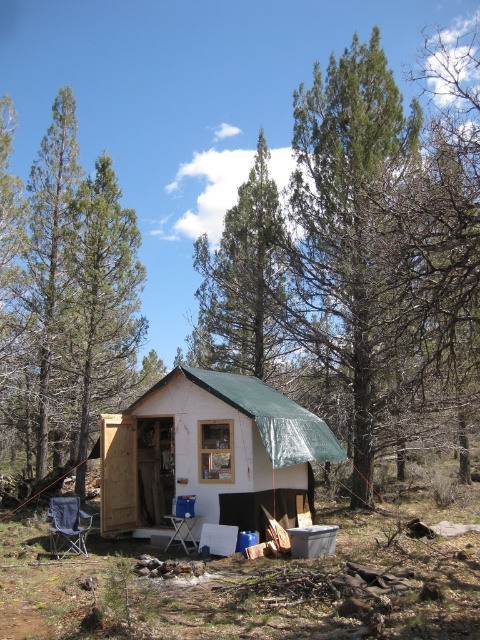
You are standing at the point marked by coordinates point [360,257]. Looking around, you see the cabin and the trees. Which direction should you walk to get to the cabin?

The green leafy tree at center is represented by point [360,257], so you are currently at the tree. To reach the cabin, you should walk towards the cabin which is in the direction opposite the tree.